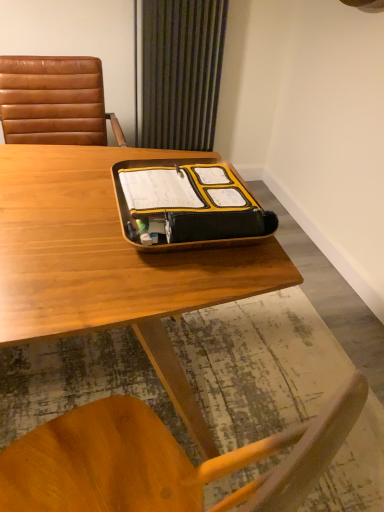
Question: From a real-world perspective, is wooden desk at center physically above green striped curtain at upper center?

Choices:
 (A) yes
 (B) no

Answer: (B)

Question: Can green striped curtain at upper center be found inside wooden desk at center?

Choices:
 (A) yes
 (B) no

Answer: (B)

Question: Can you confirm if wooden desk at center is positioned to the left of green striped curtain at upper center?

Choices:
 (A) no
 (B) yes

Answer: (B)

Question: Is wooden desk at center positioned far away from green striped curtain at upper center?

Choices:
 (A) yes
 (B) no

Answer: (A)

Question: From the image's perspective, is wooden desk at center over green striped curtain at upper center?

Choices:
 (A) no
 (B) yes

Answer: (A)

Question: From a real-world perspective, is wooden desk at center under green striped curtain at upper center?

Choices:
 (A) yes
 (B) no

Answer: (A)

Question: Is yellow matte tray at center at the left side of wooden desk at center?

Choices:
 (A) no
 (B) yes

Answer: (A)

Question: Could you tell me if yellow matte tray at center is facing wooden desk at center?

Choices:
 (A) yes
 (B) no

Answer: (B)

Question: Considering the relative positions of yellow matte tray at center and wooden desk at center in the image provided, is yellow matte tray at center in front of wooden desk at center?

Choices:
 (A) yes
 (B) no

Answer: (B)

Question: From a real-world perspective, is yellow matte tray at center located beneath wooden desk at center?

Choices:
 (A) no
 (B) yes

Answer: (A)

Question: Can you confirm if yellow matte tray at center is thinner than wooden desk at center?

Choices:
 (A) no
 (B) yes

Answer: (B)

Question: Is yellow matte tray at center positioned beyond the bounds of wooden desk at center?

Choices:
 (A) yes
 (B) no

Answer: (A)

Question: From a real-world perspective, is wooden desk at center located higher than brown leather chair at left?

Choices:
 (A) no
 (B) yes

Answer: (A)